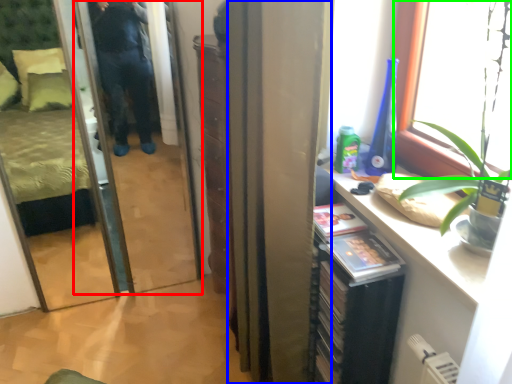
Question: Which is nearer to the screen door (highlighted by a red box)? curtain (highlighted by a blue box) or window (highlighted by a green box).

Choices:
 (A) curtain
 (B) window

Answer: (A)